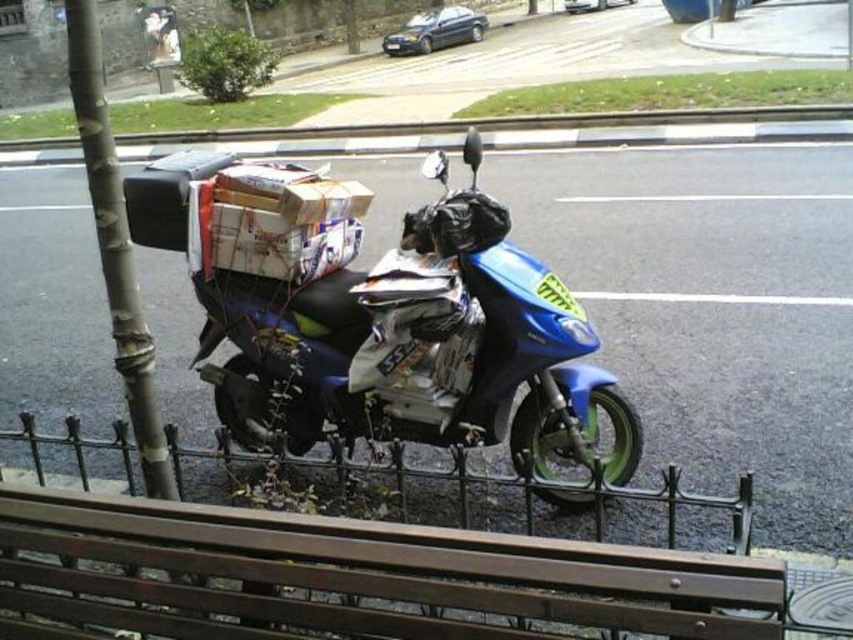
Describe the element at coordinates (351, 572) in the screenshot. I see `brown wooden bench at lower center` at that location.

Can you confirm if brown wooden bench at lower center is positioned above smooth gray pole at left?

No, brown wooden bench at lower center is not above smooth gray pole at left.

Which is behind, point (329, 593) or point (175, 493)?

The point (175, 493) is more distant.

I want to click on brown wooden bench at lower center, so click(351, 572).

Can you confirm if brown wooden bench at lower center is bigger than blue glossy motorcycle at center?

No, brown wooden bench at lower center is not bigger than blue glossy motorcycle at center.

Is point (323, 577) closer to camera compared to point (585, 342)?

Yes, point (323, 577) is closer to viewer.

Where is `brown wooden bench at lower center`? This screenshot has height=640, width=853. brown wooden bench at lower center is located at coordinates (351, 572).

Does blue glossy motorcycle at center have a smaller size compared to smooth gray pole at left?

No, blue glossy motorcycle at center is not smaller than smooth gray pole at left.

Which is more to the left, blue glossy motorcycle at center or smooth gray pole at left?

smooth gray pole at left

Is point (457, 246) more distant than point (102, 234)?

That is True.

At what (x,y) coordinates should I click in order to perform the action: click on blue glossy motorcycle at center. Please return your answer as a coordinate pair (x, y). Looking at the image, I should click on (392, 332).